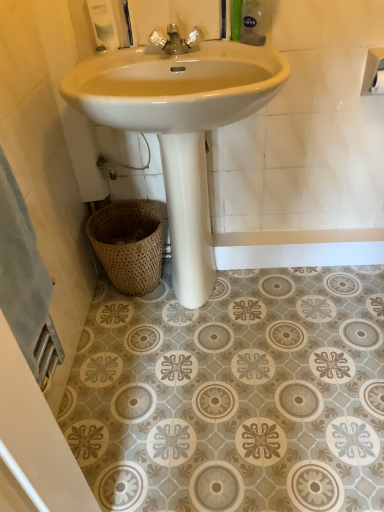
This screenshot has width=384, height=512. Find the location of `vacant space to the left of chrome metallic faucet at center`. vacant space to the left of chrome metallic faucet at center is located at coordinates (116, 55).